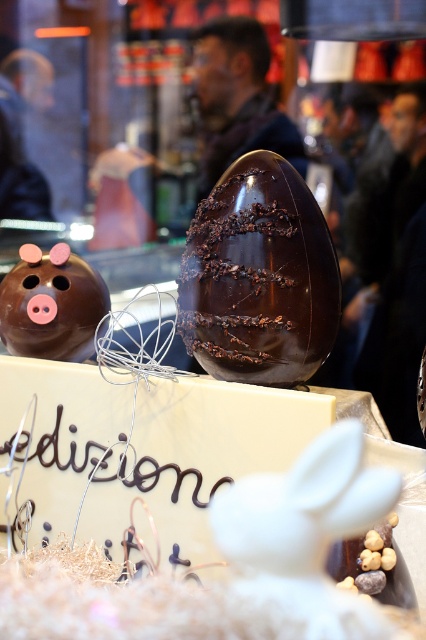
Question: Among these points, which one is farthest from the camera?

Choices:
 (A) (52, 348)
 (B) (201, 324)

Answer: (A)

Question: Does chocolateshinyegg at center appear under matte chocolate piggy bank at left?

Choices:
 (A) no
 (B) yes

Answer: (A)

Question: Observing the image, what is the correct spatial positioning of chocolateshinyegg at center in reference to matte chocolate piggy bank at left?

Choices:
 (A) above
 (B) below

Answer: (A)

Question: Is chocolateshinyegg at center to the right of matte chocolate piggy bank at left from the viewer's perspective?

Choices:
 (A) yes
 (B) no

Answer: (A)

Question: Which point is closer to the camera taking this photo?

Choices:
 (A) (81, 353)
 (B) (313, 196)

Answer: (B)